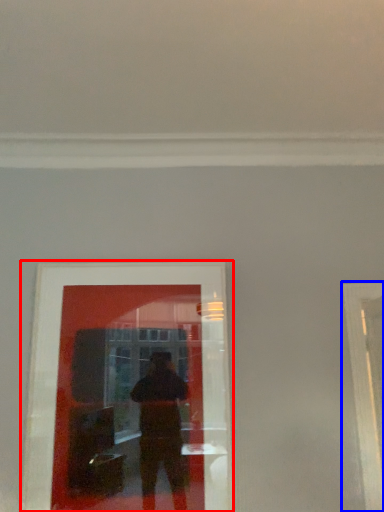
Question: Which object appears farthest to the camera in this image, picture frame (highlighted by a red box) or window frame (highlighted by a blue box)?

Choices:
 (A) picture frame
 (B) window frame

Answer: (A)